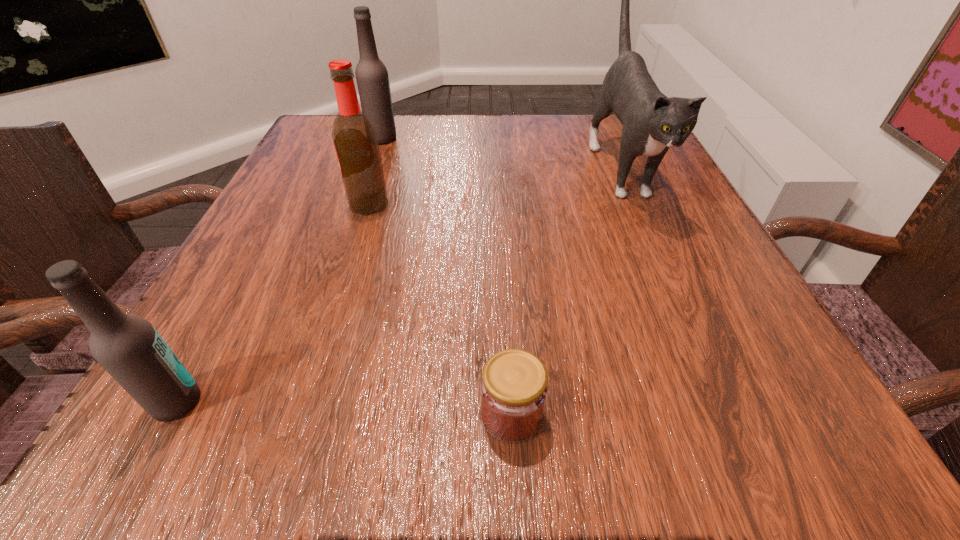
Locate an element on the screen. The height and width of the screenshot is (540, 960). free region located 0.090m on the label of the fourth tallest object is located at coordinates 276,402.

Identify the location of free space located 0.260m on the right of the jam. (768, 414).

Locate an element on the screen. cat present at the far edge is located at coordinates (652, 123).

Locate an element on the screen. The height and width of the screenshot is (540, 960). beer bottle that is at the far edge is located at coordinates (372, 78).

The width and height of the screenshot is (960, 540). Find the location of `beer bottle that is at the near edge`. beer bottle that is at the near edge is located at coordinates (128, 347).

The image size is (960, 540). Identify the location of jam at the near edge. (514, 388).

The image size is (960, 540). What are the coordinates of `object that is at the right edge` in the screenshot? It's located at (652, 123).

I want to click on object that is at the far left corner, so click(x=372, y=78).

Identify the location of object that is at the near left corner. (128, 347).

I want to click on object at the far right corner, so click(652, 123).